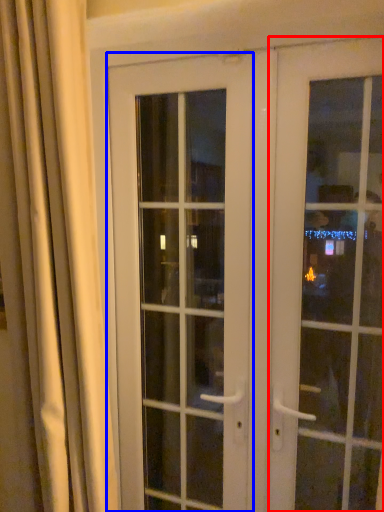
Question: Which object is closer to the camera taking this photo, door (highlighted by a red box) or door (highlighted by a blue box)?

Choices:
 (A) door
 (B) door

Answer: (A)